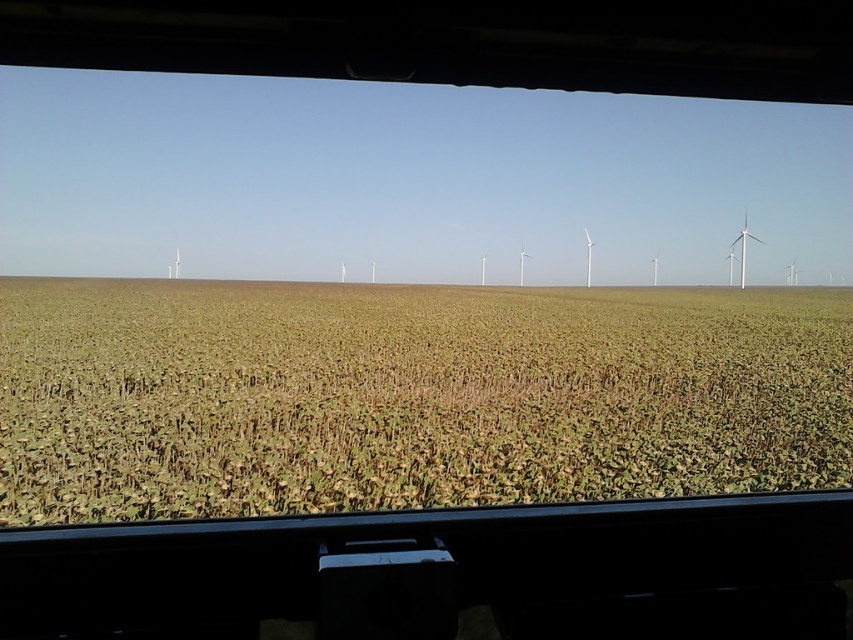
You are driving a car and looking through the front window. You see the green matte wheat field at center and the white matte wind turbine at right. Which object appears wider in the scene?

The green matte wheat field at center appears wider than the white matte wind turbine at right according to the description.

You are driving along a highway and see the green matte wheat field at center and the white matte wind turbine at right. Which object occupies more space in the scene?

The green matte wheat field at center occupies more space in the scene as it has a larger size compared to the white matte wind turbine at right.

You are driving along a highway and see two points on the horizon in the distance. One is at point (796, 384) and the other at point (740, 248). According to the image, which point is closer to your current position?

Point (796, 384) is in front of point (740, 248), so it is closer to your current position.